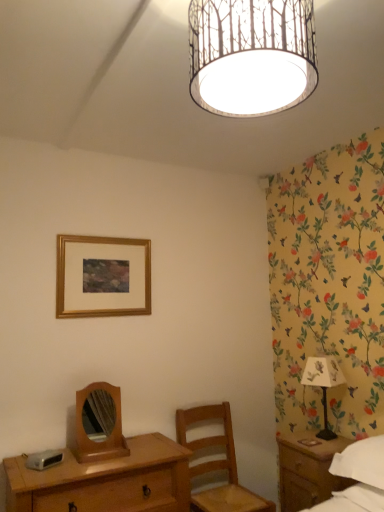
In order to click on free spot above gold wooden picture frame at upper center (from a real-world perspective) in this screenshot , I will do `click(94, 238)`.